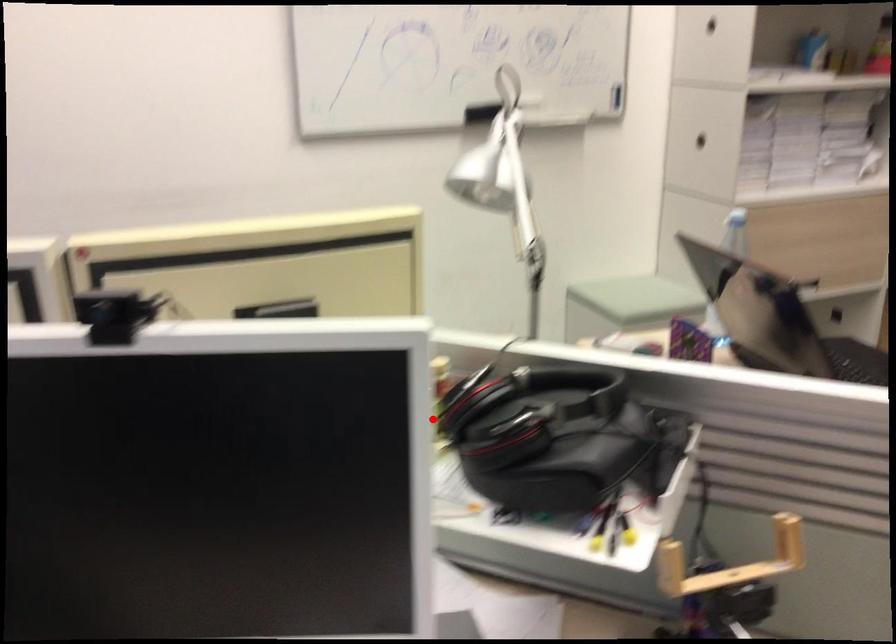
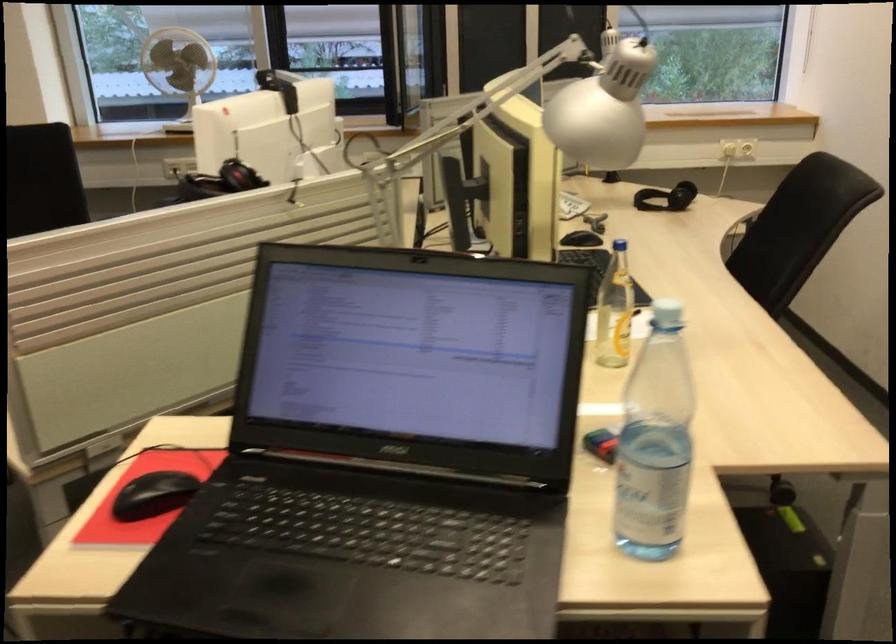
Where in the second image is the point corresponding to the highlighted location from the first image?

(220, 182)